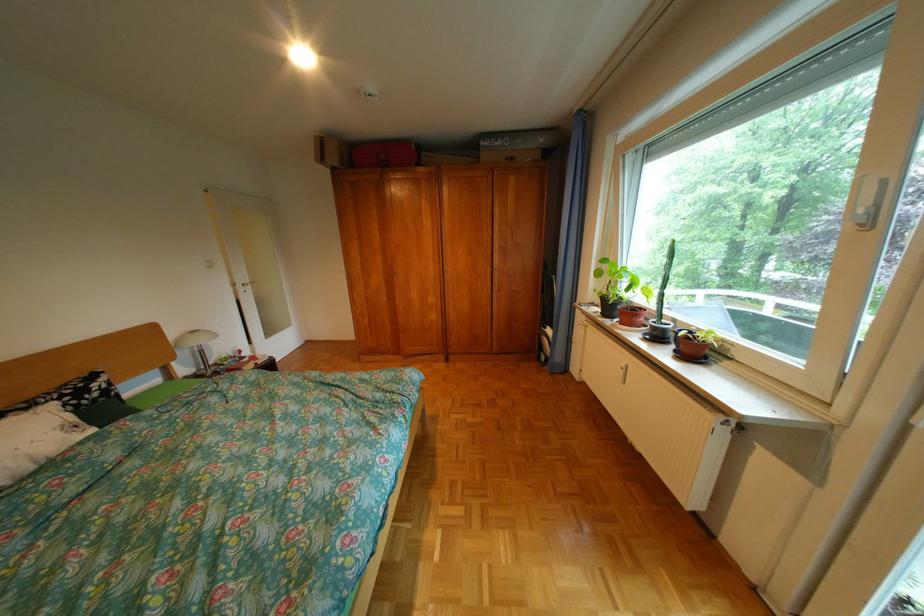
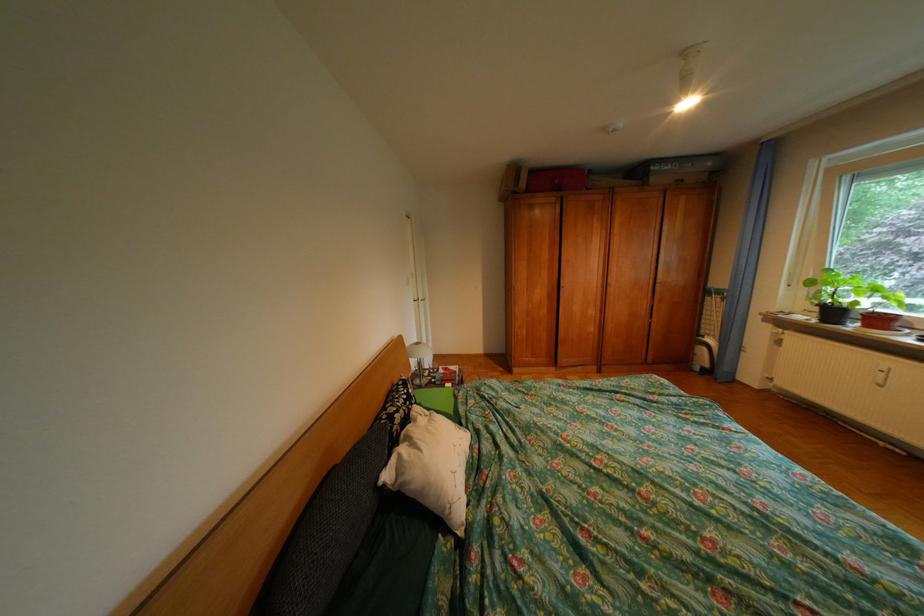
Question: The images are taken continuously from a first-person perspective. In which direction are you moving?

Choices:
 (A) Left
 (B) Right
 (C) Forward
 (D) Backward

Answer: (A)